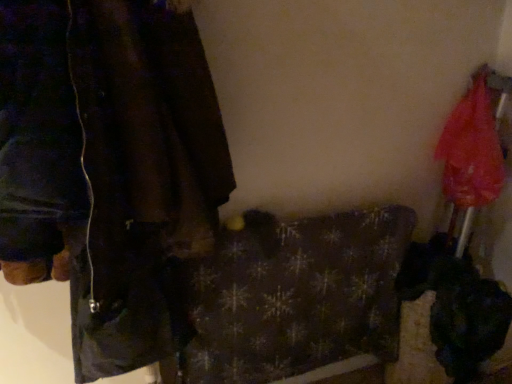
Question: Is translucent nylon umbrella at right positioned before dark brown leather jacket at left?

Choices:
 (A) yes
 (B) no

Answer: (B)

Question: Is translucent nylon umbrella at right thinner than dark brown leather jacket at left?

Choices:
 (A) no
 (B) yes

Answer: (B)

Question: Considering the relative positions of translucent nylon umbrella at right and dark brown leather jacket at left in the image provided, is translucent nylon umbrella at right to the left of dark brown leather jacket at left from the viewer's perspective?

Choices:
 (A) no
 (B) yes

Answer: (A)

Question: From a real-world perspective, is translucent nylon umbrella at right under dark brown leather jacket at left?

Choices:
 (A) yes
 (B) no

Answer: (A)

Question: From a real-world perspective, is translucent nylon umbrella at right on dark brown leather jacket at left?

Choices:
 (A) no
 (B) yes

Answer: (A)

Question: Are translucent nylon umbrella at right and dark brown leather jacket at left beside each other?

Choices:
 (A) no
 (B) yes

Answer: (A)

Question: Does translucent nylon umbrella at right have a lesser height compared to dark plaid blanket at center?

Choices:
 (A) no
 (B) yes

Answer: (B)

Question: Is translucent nylon umbrella at right located outside dark plaid blanket at center?

Choices:
 (A) no
 (B) yes

Answer: (B)

Question: Is translucent nylon umbrella at right closer to the viewer compared to dark plaid blanket at center?

Choices:
 (A) yes
 (B) no

Answer: (B)

Question: Is translucent nylon umbrella at right taller than dark plaid blanket at center?

Choices:
 (A) yes
 (B) no

Answer: (B)

Question: Is dark plaid blanket at center completely or partially inside translucent nylon umbrella at right?

Choices:
 (A) no
 (B) yes

Answer: (A)

Question: Considering the relative sizes of translucent nylon umbrella at right and dark plaid blanket at center in the image provided, is translucent nylon umbrella at right wider than dark plaid blanket at center?

Choices:
 (A) no
 (B) yes

Answer: (B)

Question: Is dark plaid blanket at center oriented towards translucent nylon umbrella at right?

Choices:
 (A) no
 (B) yes

Answer: (A)